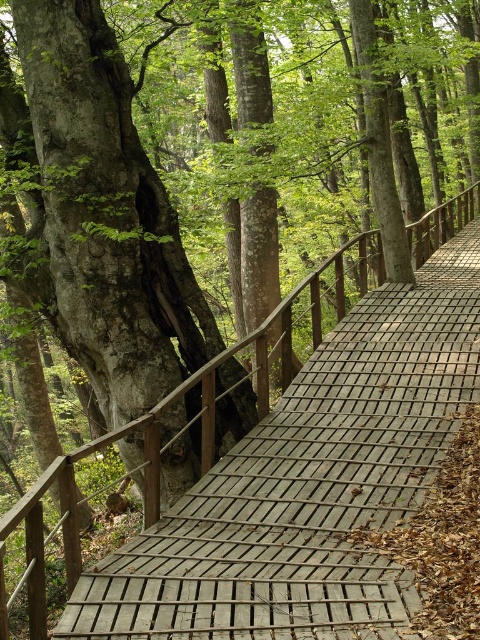
Which is more to the left, smooth gray bark at center or wooden bridge at center?

Positioned to the left is smooth gray bark at center.

Is smooth gray bark at center wider than wooden bridge at center?

Incorrect, smooth gray bark at center's width does not surpass wooden bridge at center's.

Between point (120, 177) and point (328, 616), which one is positioned behind?

Positioned behind is point (120, 177).

Locate an element on the screen. smooth gray bark at center is located at coordinates (103, 216).